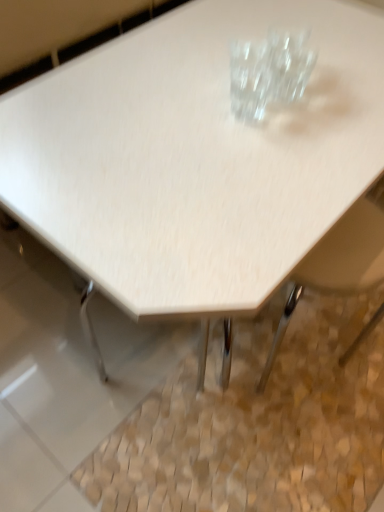
Locate an element on the screen. The image size is (384, 512). vacant area situated below metallic silver chair at lower right (from a real-world perspective) is located at coordinates (300, 393).